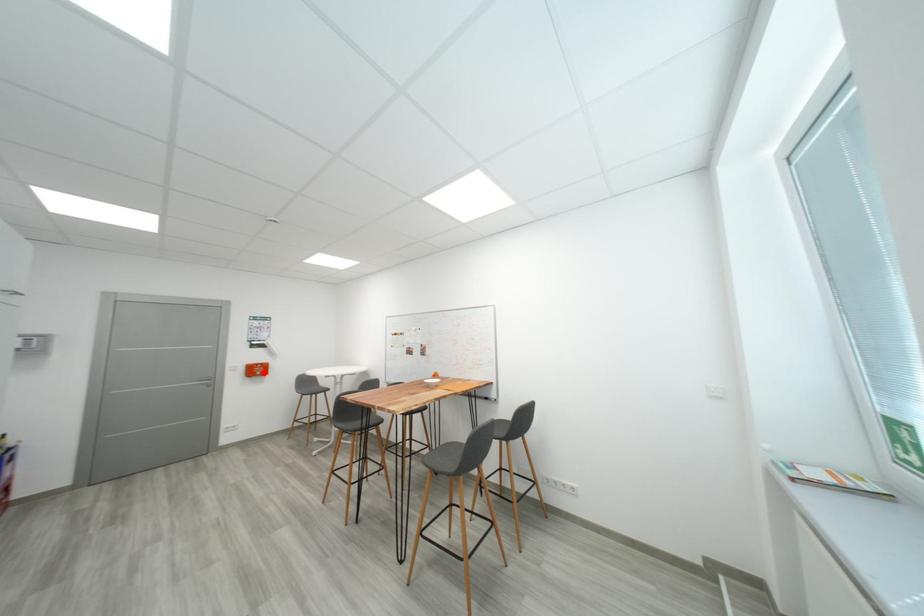
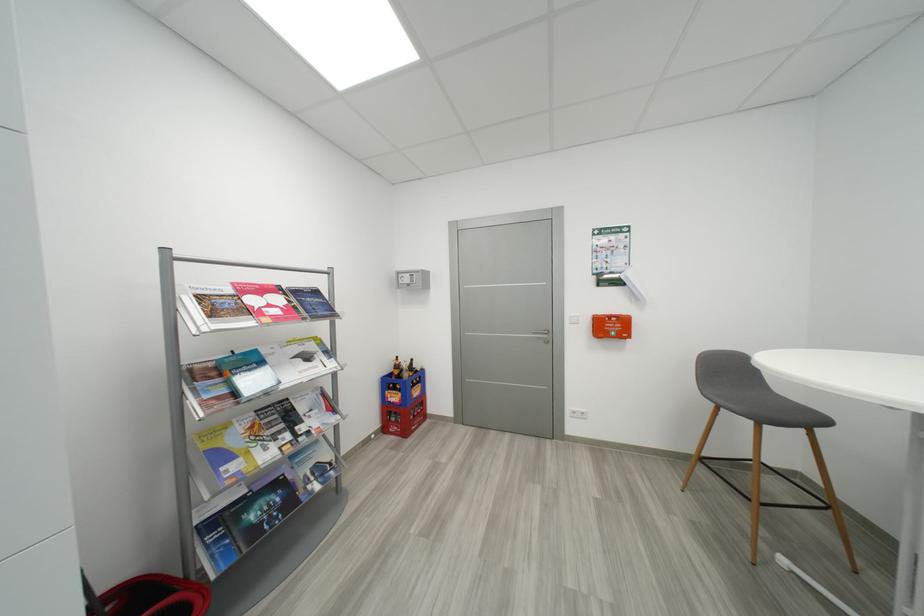
Where in the second image is the point corresponding to the highlighted location from the first image?

(617, 330)